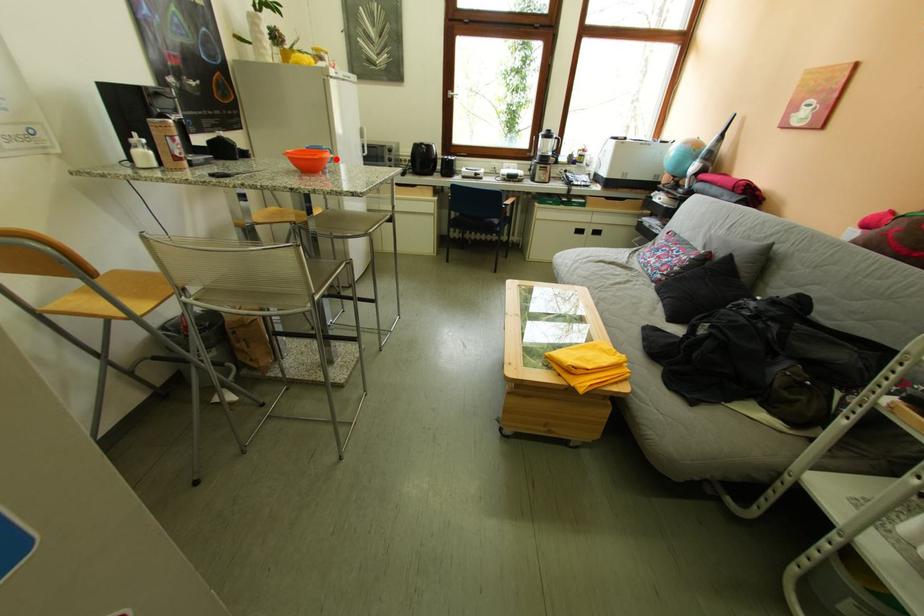
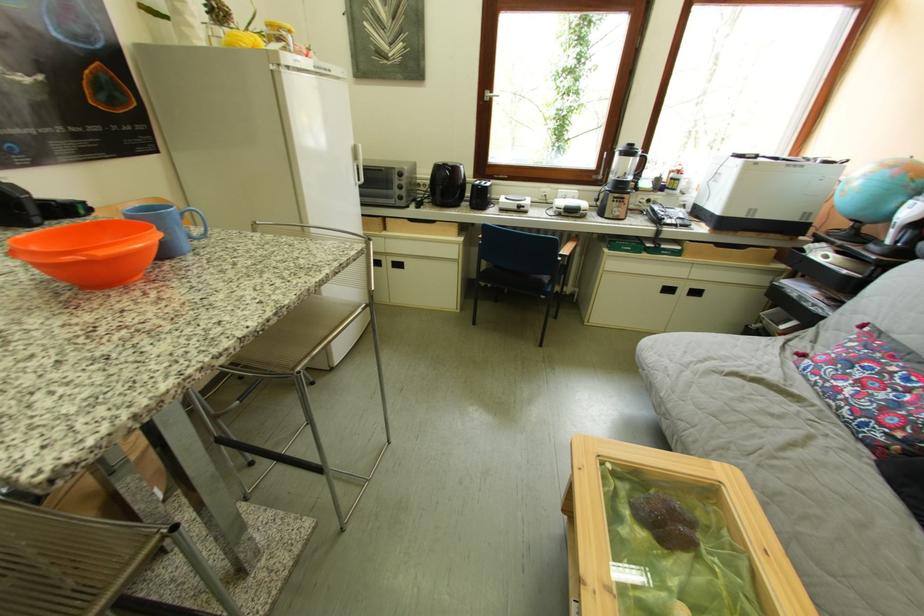
Question: I am providing you with two images of the same scene from different viewpoints. Given a red point in image1, look at the same physical point in image2. Is it:

Choices:
 (A) Closer to the viewpoint
 (B) Farther from the viewpoint

Answer: (B)